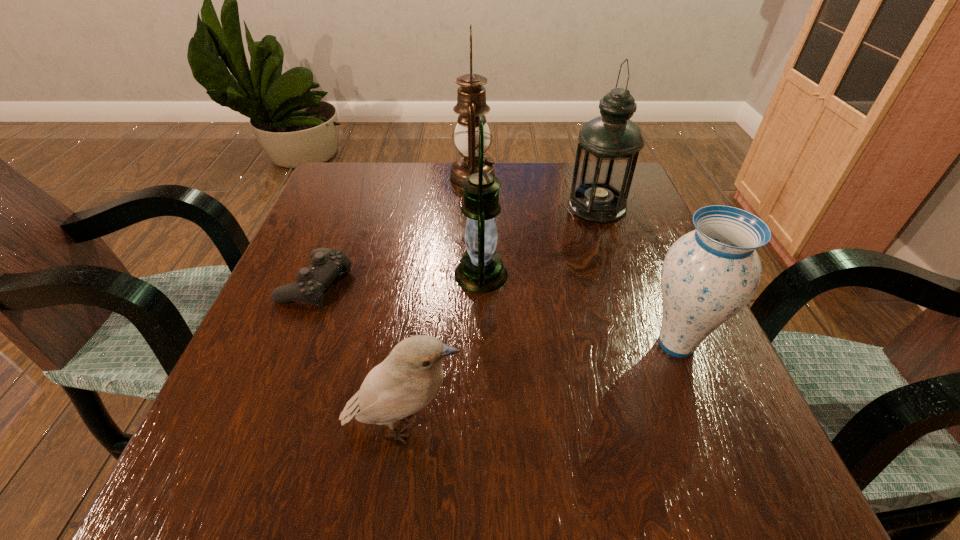
Identify the location of the left oil lamp. This screenshot has height=540, width=960. (471, 96).

Where is `the right oil lamp`? This screenshot has width=960, height=540. the right oil lamp is located at coordinates (609, 145).

Image resolution: width=960 pixels, height=540 pixels. Find the location of `lantern`. lantern is located at coordinates (480, 270).

The width and height of the screenshot is (960, 540). Find the location of `the fifth farthest object`. the fifth farthest object is located at coordinates (708, 275).

Locate an element on the screen. This screenshot has height=540, width=960. the fourth tallest object is located at coordinates (708, 275).

Identify the location of the second shortest object. (407, 380).

The image size is (960, 540). I want to click on bird, so click(x=407, y=380).

Locate an element on the screen. The width and height of the screenshot is (960, 540). the shortest object is located at coordinates (326, 264).

Locate an element on the screen. the leftmost object is located at coordinates (326, 264).

Where is `vacant space located on the front of the left oil lamp`? vacant space located on the front of the left oil lamp is located at coordinates (470, 278).